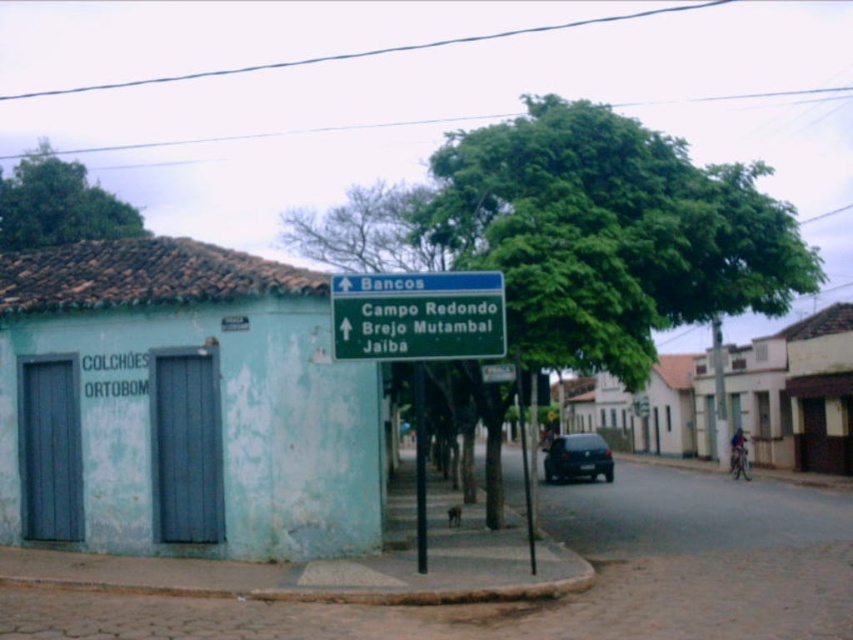
Question: Does shiny black car at center appear on the left side of green metallic pole at center?

Choices:
 (A) no
 (B) yes

Answer: (A)

Question: Which point is farther to the camera?

Choices:
 (A) green plastic sign at upper center
 (B) shiny black car at center
 (C) green metallic pole at center

Answer: (B)

Question: Considering the real-world distances, which object is farthest from the green metallic pole at center?

Choices:
 (A) green leafy tree at center
 (B) green plastic sign at upper center
 (C) shiny black car at center
 (D) green leafy tree at upper left

Answer: (D)

Question: Is green leafy tree at center bigger than green plastic sign at upper center?

Choices:
 (A) yes
 (B) no

Answer: (A)

Question: Is shiny black car at center in front of green metallic pole at center?

Choices:
 (A) yes
 (B) no

Answer: (B)

Question: Which point is closer to the camera?

Choices:
 (A) green metallic pole at center
 (B) shiny black car at center
 (C) green leafy tree at upper left

Answer: (A)